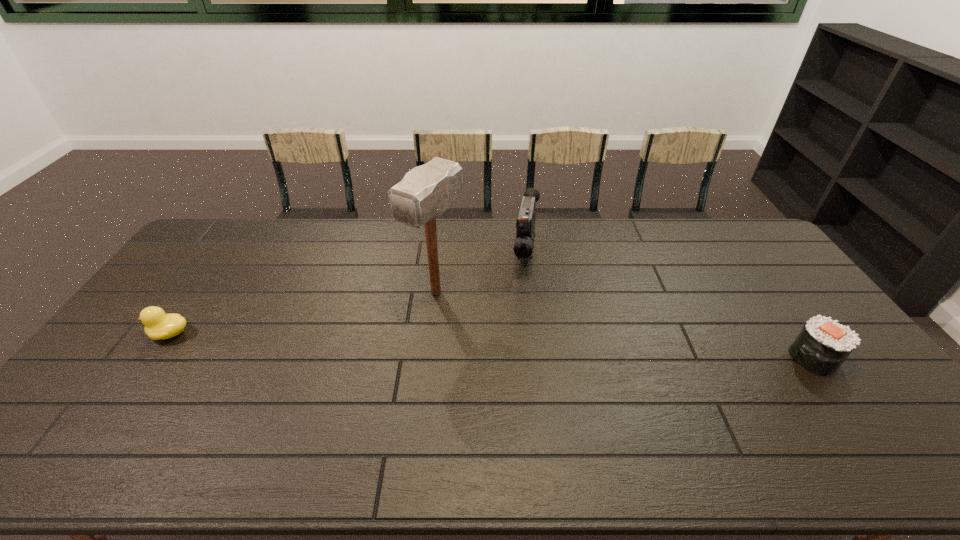
The height and width of the screenshot is (540, 960). I want to click on the leftmost object, so click(158, 325).

Where is `sushi`? sushi is located at coordinates (822, 345).

The width and height of the screenshot is (960, 540). I want to click on the third object from left to right, so click(x=525, y=225).

You are a GUI agent. You are given a task and a screenshot of the screen. Output one action in this format:
    pyautogui.click(x=<x>, y=<y>)
    Task: Click on the camcorder
    The image size is (960, 540).
    Given the screenshot: What is the action you would take?
    pyautogui.click(x=525, y=225)

I want to click on the tallest object, so click(425, 192).

Find the location of a particular element. The height and width of the screenshot is (540, 960). the second object from left to right is located at coordinates (425, 192).

I want to click on free space located 0.060m on the beak of the leftmost object, so click(129, 333).

Find the location of `free space located 0.200m on the back of the rightmost object`. free space located 0.200m on the back of the rightmost object is located at coordinates (767, 293).

This screenshot has height=540, width=960. I want to click on free space located on the front-facing side of the second object from right to left, so click(x=525, y=291).

I want to click on vacant position located 0.350m on the front-facing side of the second object from right to left, so click(x=519, y=364).